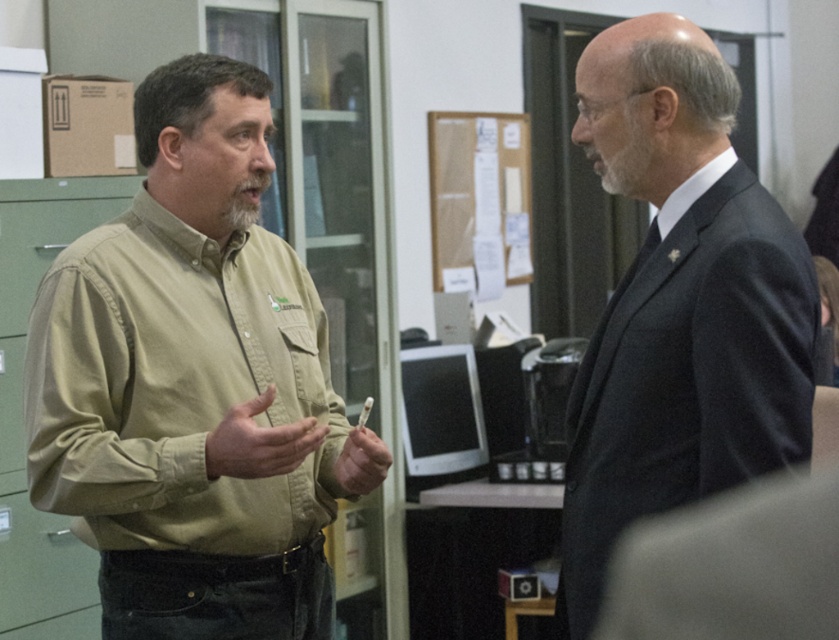
Question: Is matte khaki shirt at center in front of white smooth shirt at upper right?

Choices:
 (A) no
 (B) yes

Answer: (B)

Question: Which point is farther to the camera?

Choices:
 (A) white smooth shirt at upper right
 (B) green fabric file cabinet at left

Answer: (B)

Question: Can you confirm if green cotton shirt at left is bigger than white smooth shirt at upper right?

Choices:
 (A) no
 (B) yes

Answer: (B)

Question: Which of the following is the farthest from the observer?

Choices:
 (A) dark gray suit at right
 (B) green cotton shirt at left
 (C) matte khaki shirt at center

Answer: (B)

Question: Is green fabric file cabinet at left positioned at the back of white smooth shirt at upper right?

Choices:
 (A) no
 (B) yes

Answer: (B)

Question: Which point appears closest to the camera in this image?

Choices:
 (A) (709, 161)
 (B) (122, 531)
 (C) (681, 28)
 (D) (741, 605)

Answer: (D)